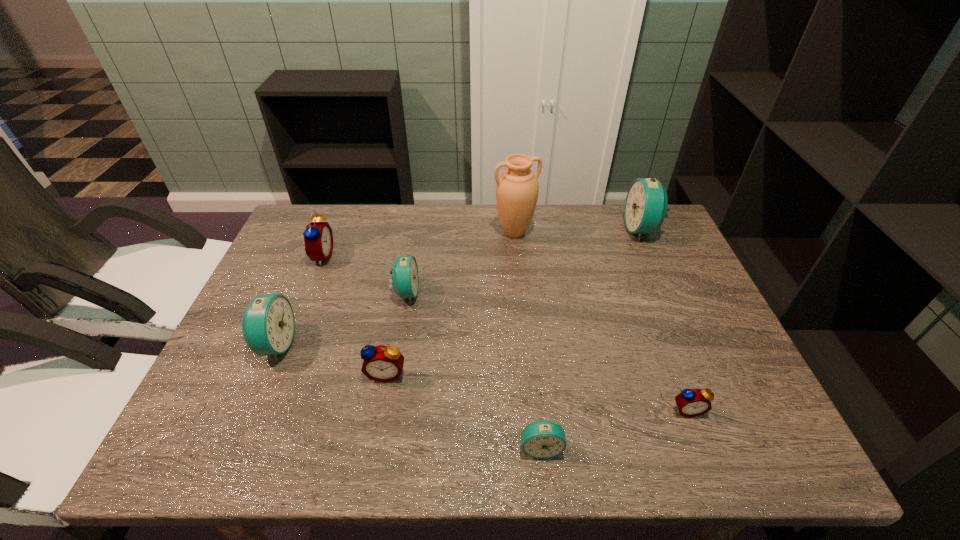
This screenshot has width=960, height=540. I want to click on red alarm clock that stands as the third closest to the second biggest blue alarm clock, so click(x=694, y=402).

This screenshot has height=540, width=960. Find the location of `the closest red alarm clock to the third blue alarm clock from right to left`. the closest red alarm clock to the third blue alarm clock from right to left is located at coordinates (381, 363).

At what (x,y) coordinates should I click in order to perform the action: click on free location that satisfies the following two spatial constraints: 1. on the front-facing side of the tallest alarm clock; 2. on the front-facing side of the third blue alarm clock from left to right. Please return your answer as a coordinate pair (x, y). The height and width of the screenshot is (540, 960). Looking at the image, I should click on (738, 448).

Where is `free point that satisfies the following two spatial constraints: 1. on the front-facing side of the biggest blue alarm clock; 2. on the front-facing side of the second farthest red alarm clock`? free point that satisfies the following two spatial constraints: 1. on the front-facing side of the biggest blue alarm clock; 2. on the front-facing side of the second farthest red alarm clock is located at coordinates (705, 374).